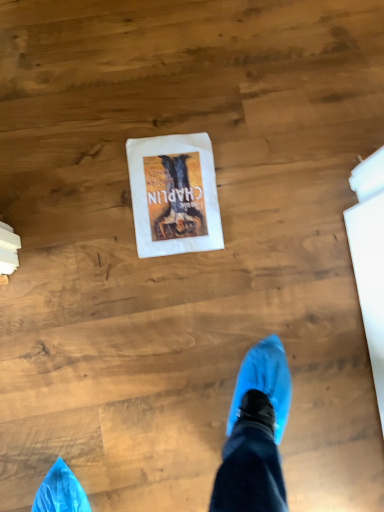
Identify the location of vacant space to the right of white paper at center. The height and width of the screenshot is (512, 384). [263, 195].